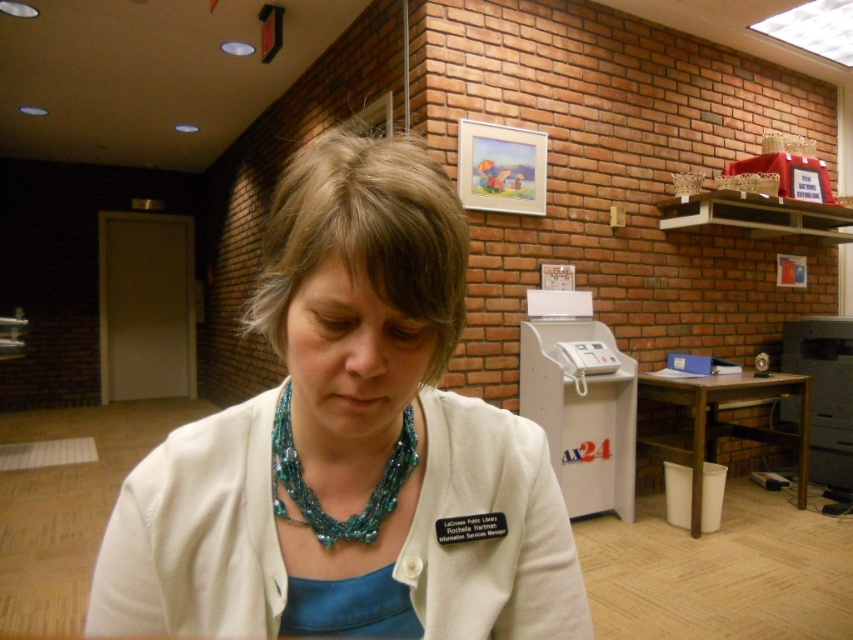
You are standing in the library and see two points marked on the wall. The first point is at coordinate (476, 458) and the second is at (281, 481). Which point is closer to you?

Point (476, 458) is further to the viewer than point (281, 481), so the second point at (281, 481) is closer to you.

You are organizing a small event in the library and need to place a 1.5 meter long banner between the white fabric jacket at center and the brown wooden table at lower right. Can the space between them accommodate the banner?

The white fabric jacket at center has a smaller size compared to brown wooden table at lower right, but the distance between them isn not specified. Without knowing the exact distance, it is impossible to determine if the banner will fit.

You are trying to locate the teal beaded necklace at center in the image. Based on the white fabric jacket at center, where would you find it relative to the jacket?

The teal beaded necklace at center is located to the left of the white fabric jacket at center because the jacket is on the right side of the necklace.